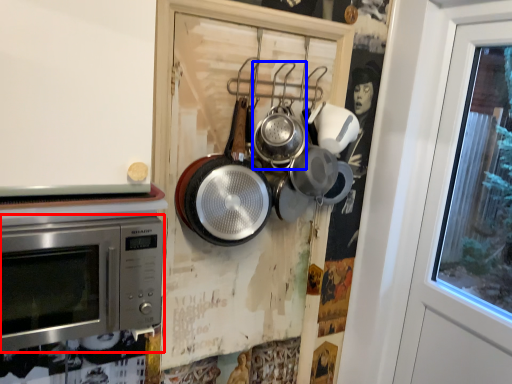
Question: Which object is closer to the camera taking this photo, microwave oven (highlighted by a red box) or frying pan (highlighted by a blue box)?

Choices:
 (A) microwave oven
 (B) frying pan

Answer: (A)